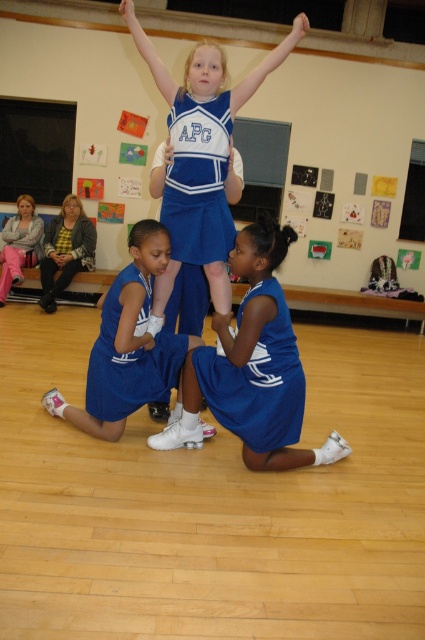
How much distance is there between blue fabric uniform at lower center and matte blue cheerleading uniform at center?

44.76 centimeters

Which is more to the right, blue fabric uniform at lower center or matte blue cheerleading uniform at center?

matte blue cheerleading uniform at center is more to the right.

Is point (178, 364) farther from viewer compared to point (212, 177)?

Yes, it is behind point (212, 177).

Where is `blue fabric uniform at lower center`? The image size is (425, 640). blue fabric uniform at lower center is located at coordinates (127, 346).

Is point (129, 362) positioned before point (99, 374)?

That is False.

Which is more to the right, blue fabric uniform at lower center or blue jersey at center?

From the viewer's perspective, blue fabric uniform at lower center appears more on the right side.

Which is behind, point (110, 388) or point (118, 301)?

Point (110, 388)

Where is `blue fabric uniform at lower center`? blue fabric uniform at lower center is located at coordinates (127, 346).

This screenshot has width=425, height=640. What are the coordinates of `blue fabric uniform at center` in the screenshot? It's located at (257, 380).

Is blue fabric uniform at center smaller than matte blue uniform at lower left?

Indeed, blue fabric uniform at center has a smaller size compared to matte blue uniform at lower left.

Is point (218, 376) more distant than point (25, 252)?

No, (218, 376) is in front of (25, 252).

In order to click on blue fabric uniform at center in this screenshot , I will do `click(257, 380)`.